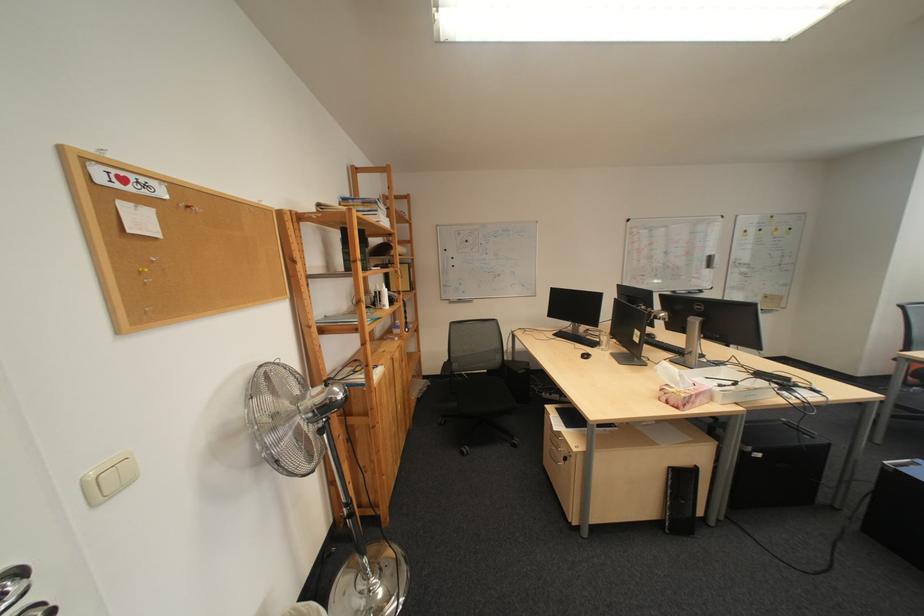
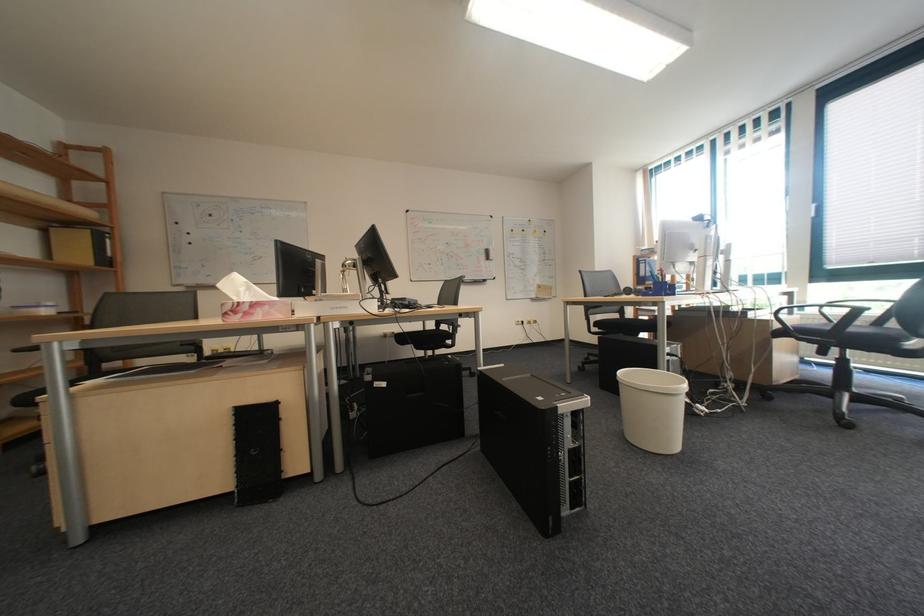
Where in the second image is the point corresponding to (712,400) from the first image?

(273, 312)